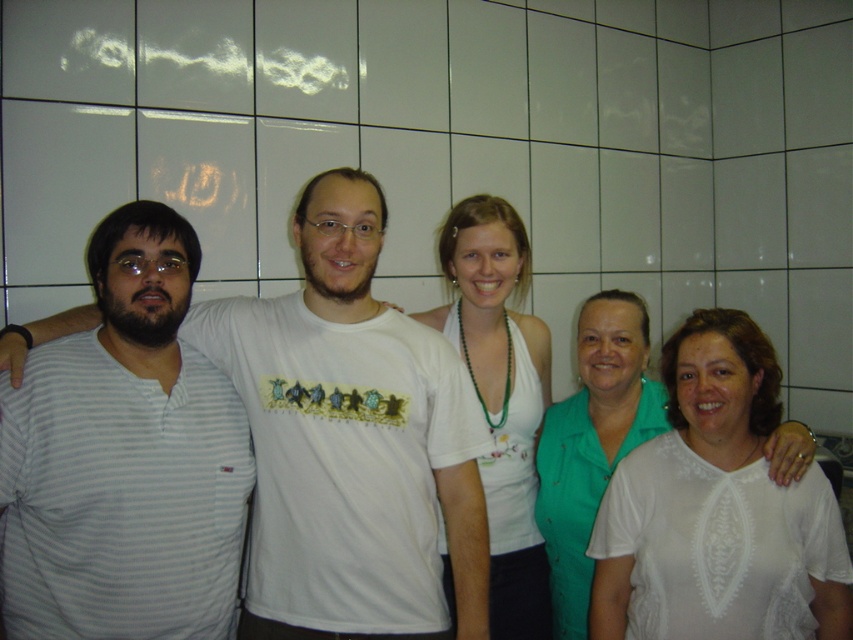
You are a fashion designer observing the group of people. You notice two white tops at the center of the image. Which one is taller between the white fabric top at center and the white lace blouse at center?

The white fabric top at center is taller than the white lace blouse at center according to the description.

You are standing in front of the group of five people against the tiled wall. There are two points marked in the scene. Can you determine which point is closer to you, point 1 at coordinates (91,531) or point 2 at coordinates (341,632)?

Point 1 at coordinates (91,531) is closer to you since it is in front of point 2 at coordinates (341,632) according to their spatial arrangement.